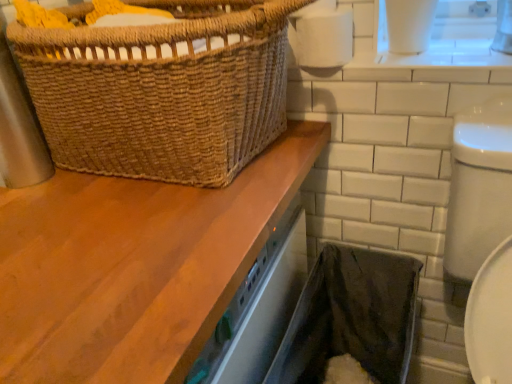
Question: In the image, is wooden countertop at upper left positioned in front of or behind white matte toilet paper at upper right?

Choices:
 (A) behind
 (B) front

Answer: (B)

Question: From a real-world perspective, is wooden countertop at upper left positioned above or below white matte toilet paper at upper right?

Choices:
 (A) below
 (B) above

Answer: (A)

Question: Which is nearer to the wooden countertop at upper left?

Choices:
 (A) brown woven basket at upper left
 (B) white matte toilet paper at upper right
 (C) black fabric laundry basket at lower right

Answer: (A)

Question: Estimate the real-world distances between objects in this image. Which object is closer to the white matte toilet paper at upper right?

Choices:
 (A) wooden countertop at upper left
 (B) black fabric laundry basket at lower right
 (C) brown woven basket at upper left

Answer: (C)